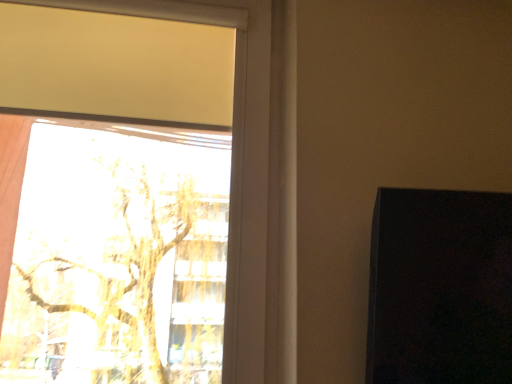
Question: Should I look upward or downward to see transparent glass window at upper left?

Choices:
 (A) down
 (B) up

Answer: (B)